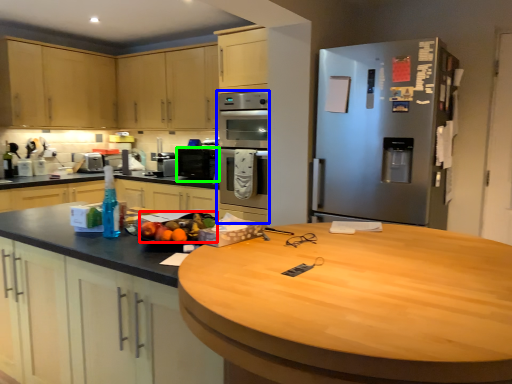
Question: Which object is positioned farthest from fruit (highlighted by a red box)? Select from oven (highlighted by a blue box) and kitchen appliance (highlighted by a green box).

Choices:
 (A) oven
 (B) kitchen appliance

Answer: (B)